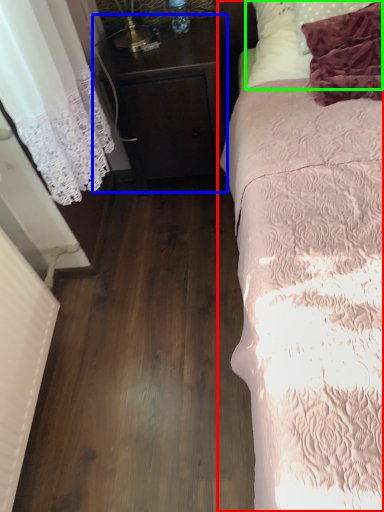
Question: Which object is positioned closest to bed (highlighted by a red box)? Select from nightstand (highlighted by a blue box) and pillow (highlighted by a green box).

Choices:
 (A) nightstand
 (B) pillow

Answer: (B)